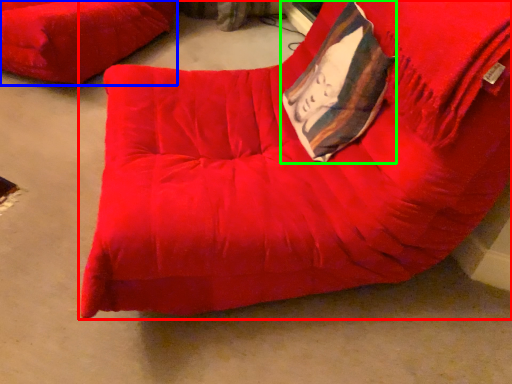
Question: Which object is the farthest from furniture (highlighted by a red box)? Choose among these: furniture (highlighted by a blue box) or throw pillow (highlighted by a green box).

Choices:
 (A) furniture
 (B) throw pillow

Answer: (A)